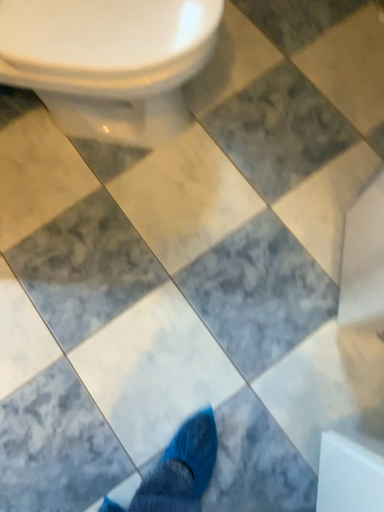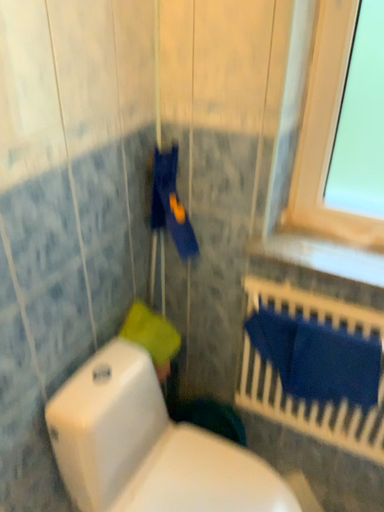
Question: Which way did the camera rotate in the video?

Choices:
 (A) rotated upward
 (B) rotated downward

Answer: (A)